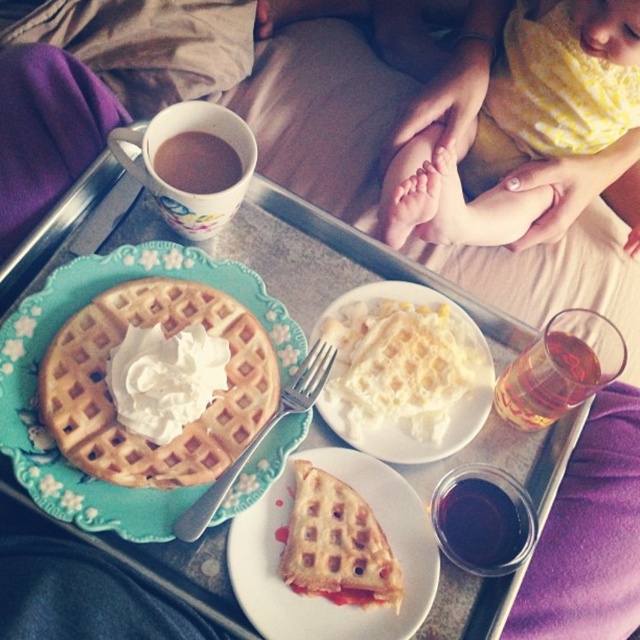
Does golden brown waffle with whipped cream at left have a greater width compared to white matte waffle at center?

Indeed, golden brown waffle with whipped cream at left has a greater width compared to white matte waffle at center.

Who is taller, golden brown waffle with whipped cream at left or white matte waffle at center?

golden brown waffle with whipped cream at left

Looking at this image, who is more distant from viewer, (x=236, y=317) or (x=333, y=362)?

Point (x=333, y=362)

Locate an element on the screen. Image resolution: width=640 pixels, height=640 pixels. golden brown waffle with whipped cream at left is located at coordinates (113, 404).

How far apart are white matte waffle at center and dark red liquid at lower right?

white matte waffle at center is 4.08 inches from dark red liquid at lower right.

Is white matte waffle at center thinner than dark red liquid at lower right?

In fact, white matte waffle at center might be wider than dark red liquid at lower right.

Between point (433, 356) and point (474, 472), which one is positioned behind?

The point (433, 356) is behind.

This screenshot has width=640, height=640. In order to click on white matte waffle at center in this screenshot , I will do `click(404, 372)`.

Does white matte waffle at center lie behind white matte plate at center?

Yes, white matte waffle at center is further from the viewer.

Does white matte waffle at center come in front of white matte plate at center?

No, white matte waffle at center is further to the viewer.

What do you see at coordinates (404, 372) in the screenshot? I see `white matte waffle at center` at bounding box center [404, 372].

You are a GUI agent. You are given a task and a screenshot of the screen. Output one action in this format:
    pyautogui.click(x=<x>, y=<y>)
    Task: Click on the white matte waffle at center
    
    Given the screenshot: What is the action you would take?
    [404, 372]